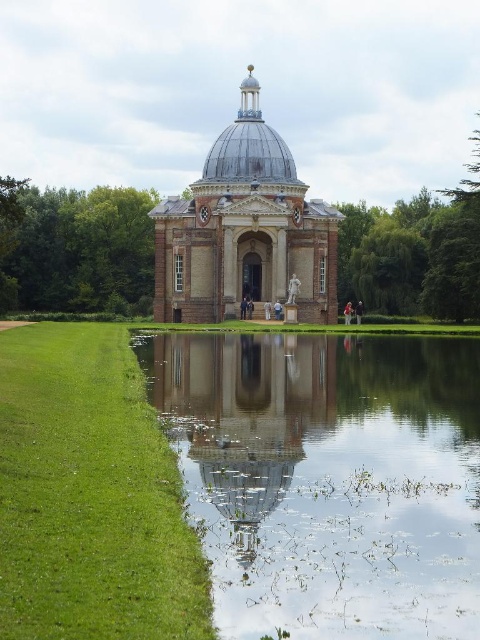
Question: Considering the real-world distances, which object is closest to the smooth glass dome at center?

Choices:
 (A) white brick palace at center
 (B) metallic silver dome at center
 (C) clear water at center

Answer: (C)

Question: Is white brick palace at center closer to camera compared to metallic silver dome at center?

Choices:
 (A) no
 (B) yes

Answer: (B)

Question: Is white brick palace at center positioned before metallic silver dome at center?

Choices:
 (A) yes
 (B) no

Answer: (A)

Question: Which point is farther to the camera?

Choices:
 (A) smooth glass dome at center
 (B) white brick palace at center
 (C) clear water at center
 (D) metallic silver dome at center

Answer: (D)

Question: Is clear water at center wider than metallic silver dome at center?

Choices:
 (A) yes
 (B) no

Answer: (A)

Question: Considering the real-world distances, which object is closest to the metallic silver dome at center?

Choices:
 (A) white brick palace at center
 (B) clear water at center

Answer: (A)